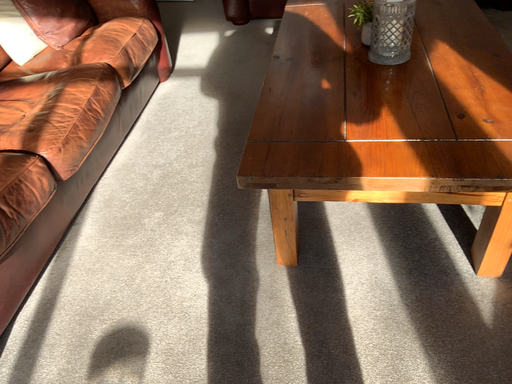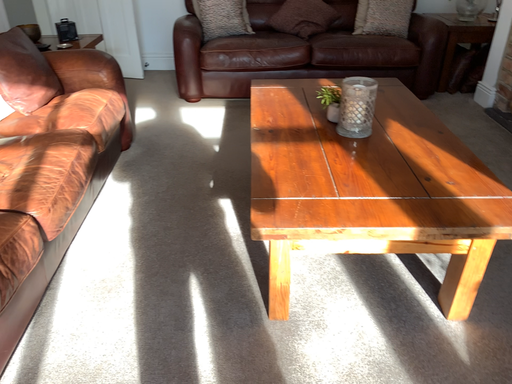
Question: Which way did the camera rotate in the video?

Choices:
 (A) rotated upward
 (B) rotated downward

Answer: (A)